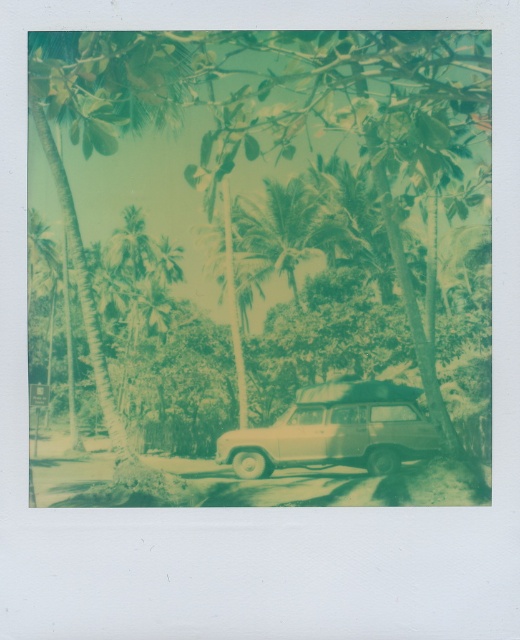
You are a hiker planning to park your beige matte suv at center near the green leafy palm tree at center. Based on the scene description, will the suv be completely shaded by the palm tree?

The beige matte suv at center is positioned under green leafy palm tree at center, so yes, the suv will be completely shaded by the palm tree.

You are a hiker trying to take a photo of the green leafy palm tree at center from the beige matte suv at center. Can you see the entire palm tree in your viewfinder without moving the suv or the tree?

The beige matte suv at center is in front of the green leafy palm tree at center, so the suv is blocking part of the tree. Therefore, you cannot see the entire palm tree in your viewfinder without moving either the suv or the tree.